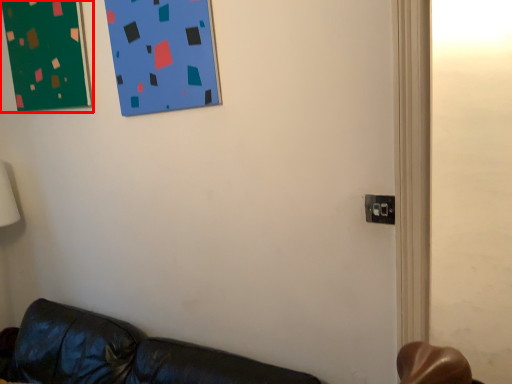
Question: In this image, where is bulletin board (annotated by the red box) located relative to electric outlet?

Choices:
 (A) right
 (B) left

Answer: (B)